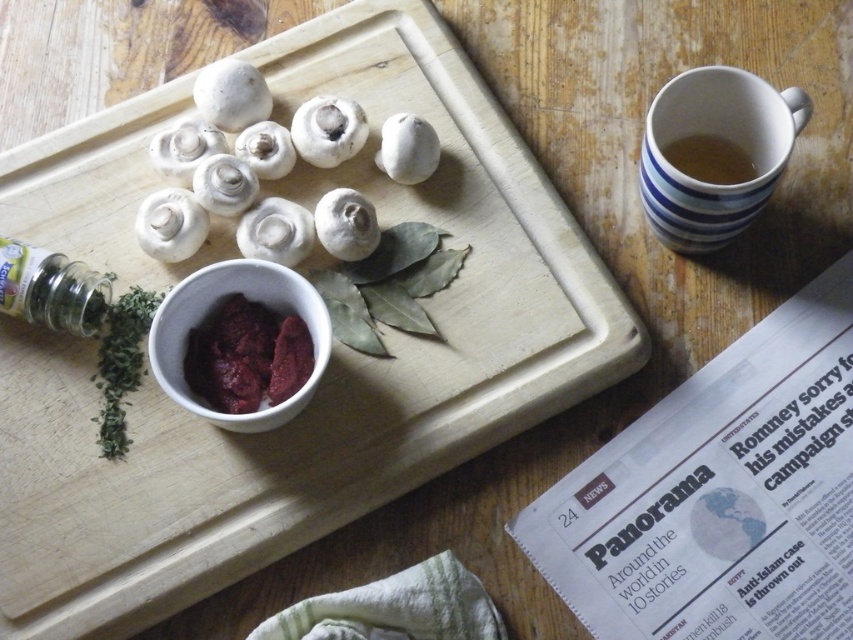
This screenshot has width=853, height=640. What do you see at coordinates (717, 140) in the screenshot?
I see `blue striped mug at upper right` at bounding box center [717, 140].

Can you confirm if blue striped mug at upper right is positioned to the left of brown ceramic mug at upper right?

Correct, you'll find blue striped mug at upper right to the left of brown ceramic mug at upper right.

Locate an element on the screen. The width and height of the screenshot is (853, 640). blue striped mug at upper right is located at coordinates (717, 140).

Who is lower down, green glass jar at lower left or white matte mushroom at center?

green glass jar at lower left is lower down.

Can you confirm if green glass jar at lower left is bigger than white matte mushroom at center?

Correct, green glass jar at lower left is larger in size than white matte mushroom at center.

Locate an element on the screen. The image size is (853, 640). green glass jar at lower left is located at coordinates (51, 289).

Can you confirm if white matte mushroom at upper center is shorter than brown ceramic mug at upper right?

Incorrect, white matte mushroom at upper center's height does not fall short of brown ceramic mug at upper right's.

Which is in front, point (384, 147) or point (714, 166)?

Point (714, 166) is in front.

What do you see at coordinates (407, 148) in the screenshot? The height and width of the screenshot is (640, 853). I see `white matte mushroom at upper center` at bounding box center [407, 148].

I want to click on white matte mushroom at upper center, so click(407, 148).